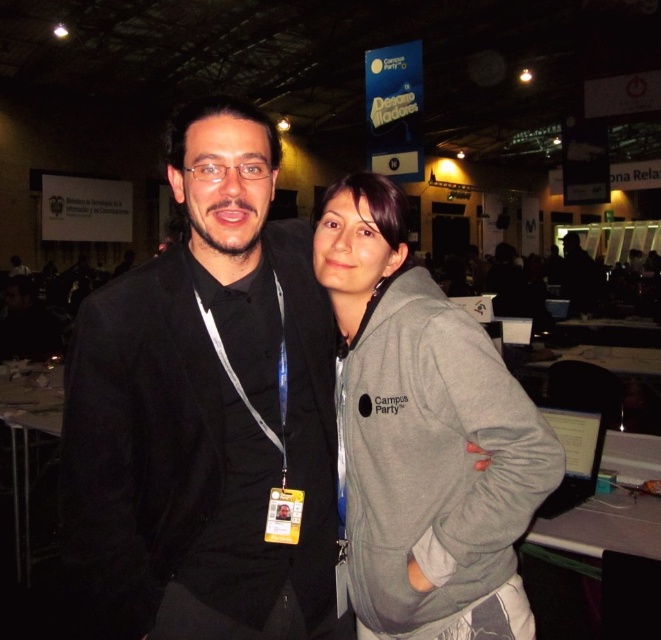
This screenshot has width=661, height=640. Identify the location of black matte suit at center. (204, 412).

Does point (266, 282) lie behind point (549, 460)?

Yes, point (266, 282) is farther from viewer.

Does point (249, 541) lie in front of point (381, 579)?

Yes.

Locate an element on the screen. This screenshot has width=661, height=640. black matte suit at center is located at coordinates (204, 412).